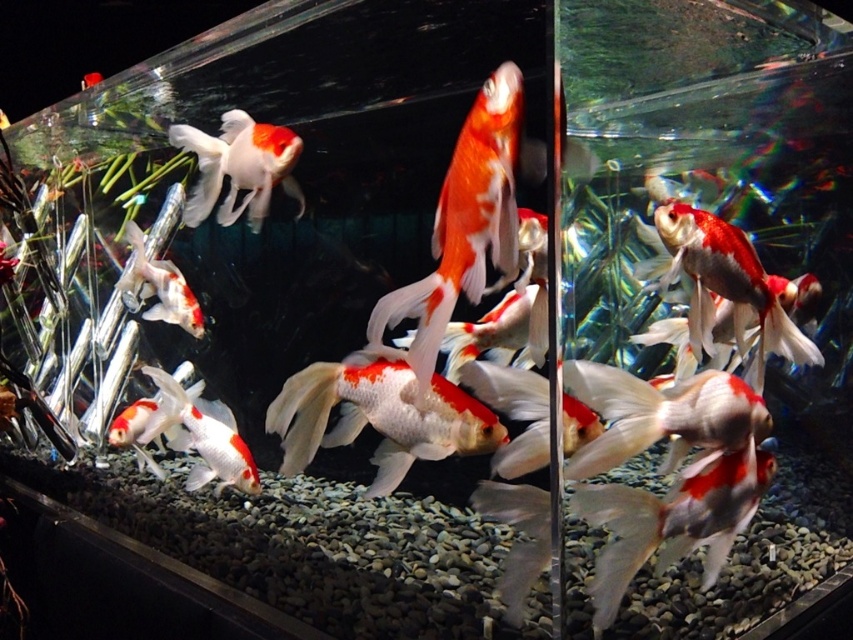
You are a new fish in the aquarium and want to swim to the shiny metallic goldfish at center. From your current position near the shiny orange and white goldfish at upper left, which direction should you swim to reach it?

The shiny metallic goldfish at center is closer to the viewer than the shiny orange and white goldfish at upper left, so you should swim forward towards the viewer to reach it.

You are a new goldfish in the aquarium and want to swim to the shiny metallic goldfish at center. Which direction should you swim to avoid the shiny orange and white fish at center?

The shiny orange and white fish at center is located above the shiny metallic goldfish at center. To avoid it, swim downward towards the shiny metallic goldfish at center.

In the aquarium scene, there are two fish at the center of the tank. The first is a shiny orange and white fish at center, and the second is a shiny metallic goldfish at center. Which one is positioned more to the left?

The shiny orange and white fish at center is positioned more to the left than the shiny metallic goldfish at center.